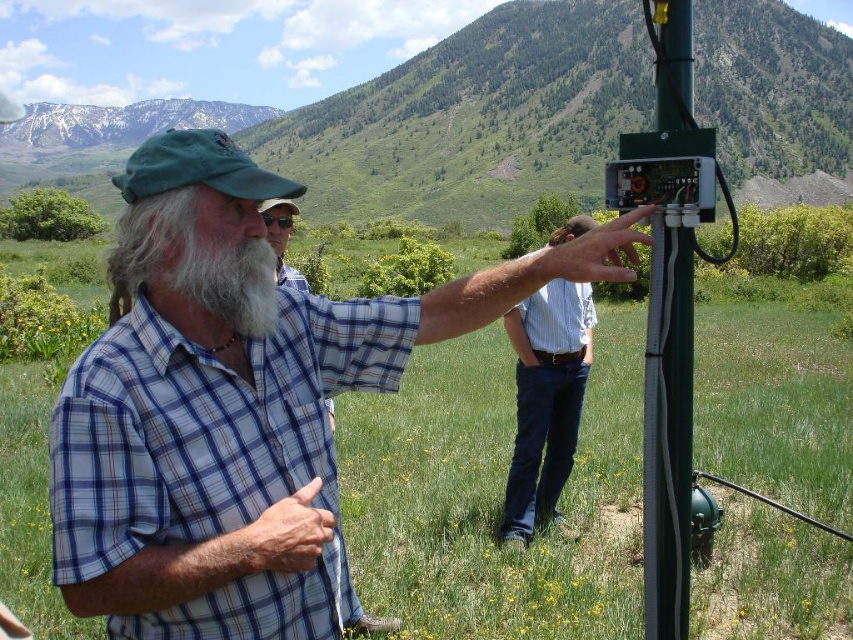
Question: Does white matte beard at center have a smaller size compared to plaid cotton shirt at center?

Choices:
 (A) yes
 (B) no

Answer: (A)

Question: Which is nearer to the plaid shirt at center?

Choices:
 (A) plaid cotton shirt at center
 (B) white matte beard at center

Answer: (B)

Question: Among these objects, which one is farthest from the camera?

Choices:
 (A) blue jeans at center
 (B) plaid cotton shirt at center
 (C) plaid shirt at center

Answer: (A)

Question: Is plaid shirt at center thinner than white matte beard at center?

Choices:
 (A) no
 (B) yes

Answer: (A)

Question: In this image, where is plaid shirt at center located relative to plaid cotton shirt at center?

Choices:
 (A) above
 (B) below

Answer: (B)

Question: Among these objects, which one is nearest to the camera?

Choices:
 (A) blue jeans at center
 (B) plaid cotton shirt at center
 (C) plaid shirt at center
 (D) white matte beard at center

Answer: (C)